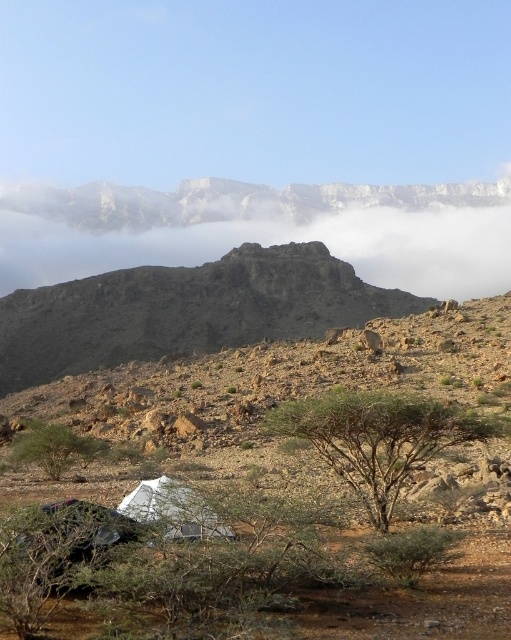
You are an explorer in a desert and see a white foggy cloud at upper center and a green leafy tree at center. Which object is higher up in the sky?

The white foggy cloud at upper center is positioned over the green leafy tree at center, so it is higher up in the sky.

You are a hiker in the desert and see the white foggy cloud at upper center and the green leafy tree at lower left. Which object is positioned more to the east?

The green leafy tree at lower left is positioned more to the east because the white foggy cloud at upper center is to the right of it, and in a typical map orientation, right corresponds to east.